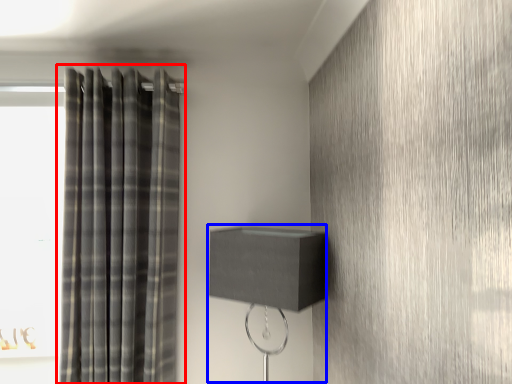
Question: Which object is further to the camera taking this photo, curtain (highlighted by a red box) or table lamp (highlighted by a blue box)?

Choices:
 (A) curtain
 (B) table lamp

Answer: (A)